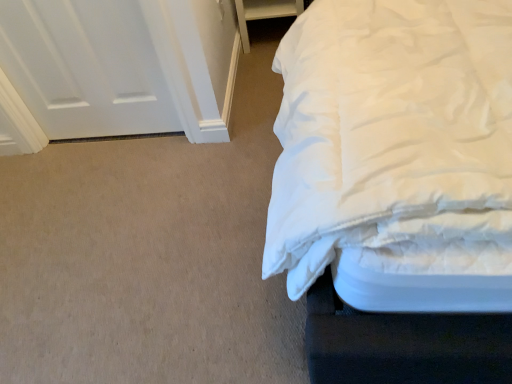
Question: Considering their positions, is white fabric drawer at upper right located in front of or behind white matte door at upper left?

Choices:
 (A) behind
 (B) front

Answer: (A)

Question: In terms of height, does white fabric drawer at upper right look taller or shorter compared to white matte door at upper left?

Choices:
 (A) short
 (B) tall

Answer: (A)

Question: Would you say white fabric drawer at upper right is to the left or to the right of white matte door at upper left in the picture?

Choices:
 (A) right
 (B) left

Answer: (A)

Question: Considering the positions of white matte door at upper left and white fabric drawer at upper right in the image, is white matte door at upper left taller or shorter than white fabric drawer at upper right?

Choices:
 (A) short
 (B) tall

Answer: (B)

Question: From a real-world perspective, is white matte door at upper left positioned above or below white fabric drawer at upper right?

Choices:
 (A) below
 (B) above

Answer: (B)

Question: Choose the correct answer: Is white matte door at upper left inside white fabric drawer at upper right or outside it?

Choices:
 (A) outside
 (B) inside

Answer: (A)

Question: Relative to white fabric drawer at upper right, is white matte door at upper left in front or behind?

Choices:
 (A) front
 (B) behind

Answer: (A)